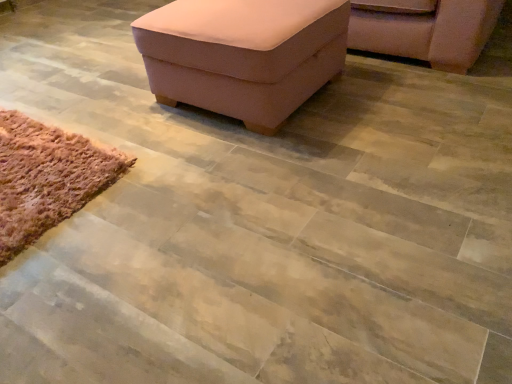
Question: Is brown fuzzy rug at lower left facing towards pink fabric ottoman at upper center?

Choices:
 (A) yes
 (B) no

Answer: (B)

Question: Considering the relative sizes of brown fuzzy rug at lower left and pink fabric ottoman at upper center in the image provided, is brown fuzzy rug at lower left taller than pink fabric ottoman at upper center?

Choices:
 (A) yes
 (B) no

Answer: (B)

Question: Is brown fuzzy rug at lower left turned away from pink fabric ottoman at upper center?

Choices:
 (A) no
 (B) yes

Answer: (A)

Question: Is brown fuzzy rug at lower left at the left side of pink fabric ottoman at upper center?

Choices:
 (A) no
 (B) yes

Answer: (B)

Question: From the image's perspective, is brown fuzzy rug at lower left located above pink fabric ottoman at upper center?

Choices:
 (A) yes
 (B) no

Answer: (B)

Question: Is point (374, 26) positioned closer to the camera than point (10, 168)?

Choices:
 (A) farther
 (B) closer

Answer: (A)

Question: Is pink fabric chair at upper right bigger or smaller than brown fuzzy rug at lower left?

Choices:
 (A) small
 (B) big

Answer: (B)

Question: Is pink fabric chair at upper right inside or outside of brown fuzzy rug at lower left?

Choices:
 (A) outside
 (B) inside

Answer: (A)

Question: From the image's perspective, is pink fabric chair at upper right positioned above or below brown fuzzy rug at lower left?

Choices:
 (A) above
 (B) below

Answer: (A)

Question: In terms of size, does pink fabric ottoman at upper center appear bigger or smaller than pink fabric chair at upper right?

Choices:
 (A) small
 (B) big

Answer: (A)

Question: Is pink fabric ottoman at upper center wider or thinner than pink fabric chair at upper right?

Choices:
 (A) thin
 (B) wide

Answer: (A)

Question: Is point (183, 77) positioned closer to the camera than point (467, 51)?

Choices:
 (A) closer
 (B) farther

Answer: (A)

Question: Do you think pink fabric ottoman at upper center is within pink fabric chair at upper right, or outside of it?

Choices:
 (A) inside
 (B) outside

Answer: (B)

Question: Is point (424, 44) positioned closer to the camera than point (287, 34)?

Choices:
 (A) farther
 (B) closer

Answer: (A)

Question: From their relative heights in the image, would you say pink fabric chair at upper right is taller or shorter than pink fabric ottoman at upper center?

Choices:
 (A) short
 (B) tall

Answer: (A)